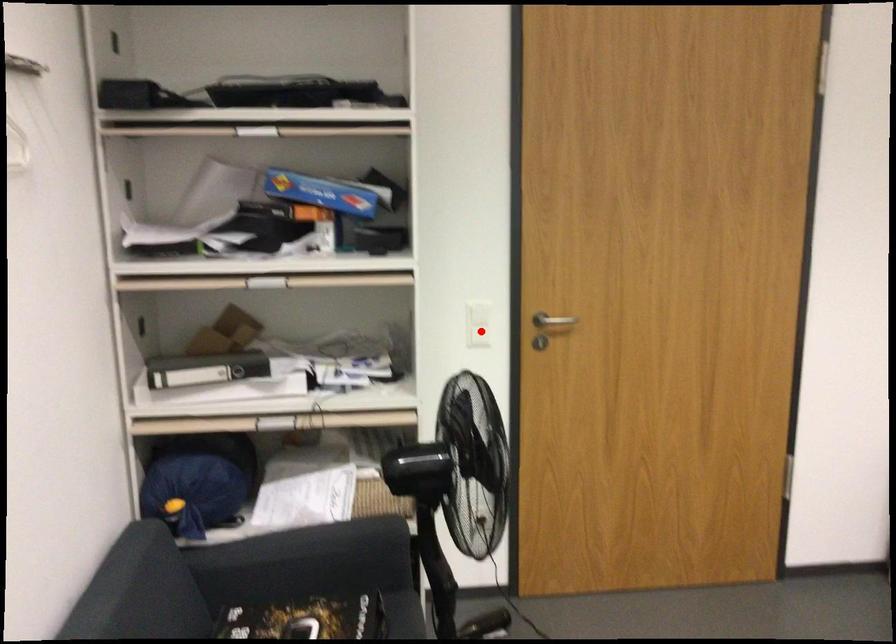
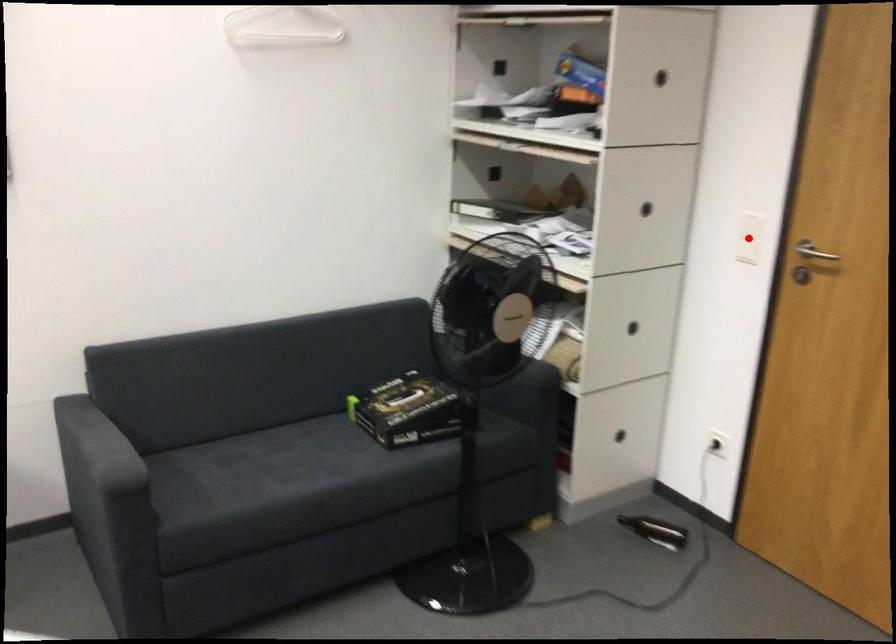
I am providing you with two images of the same scene from different viewpoints. A red point is marked on the first image and another point is marked on the second image. Does the point marked in image1 correspond to the same location as the one in image2?

Yes